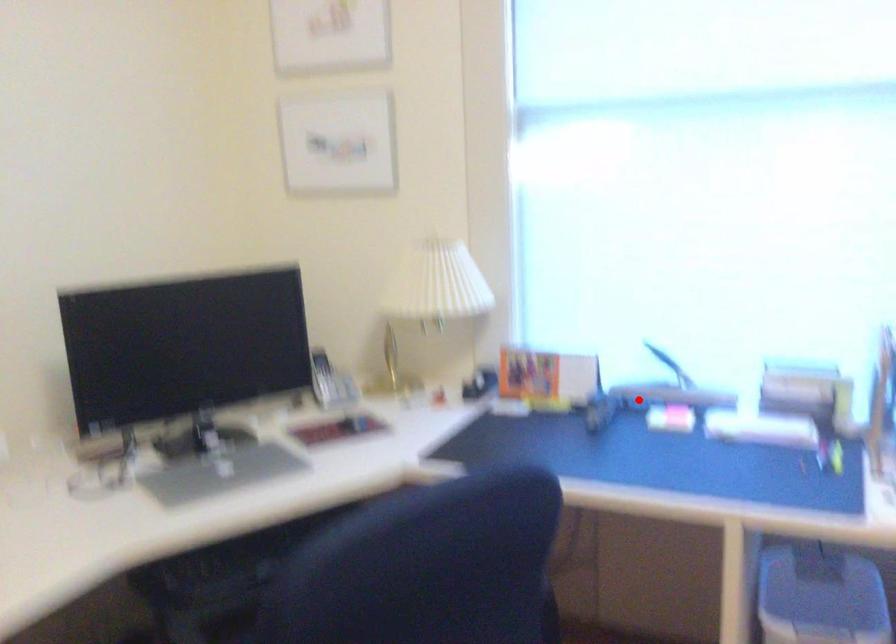
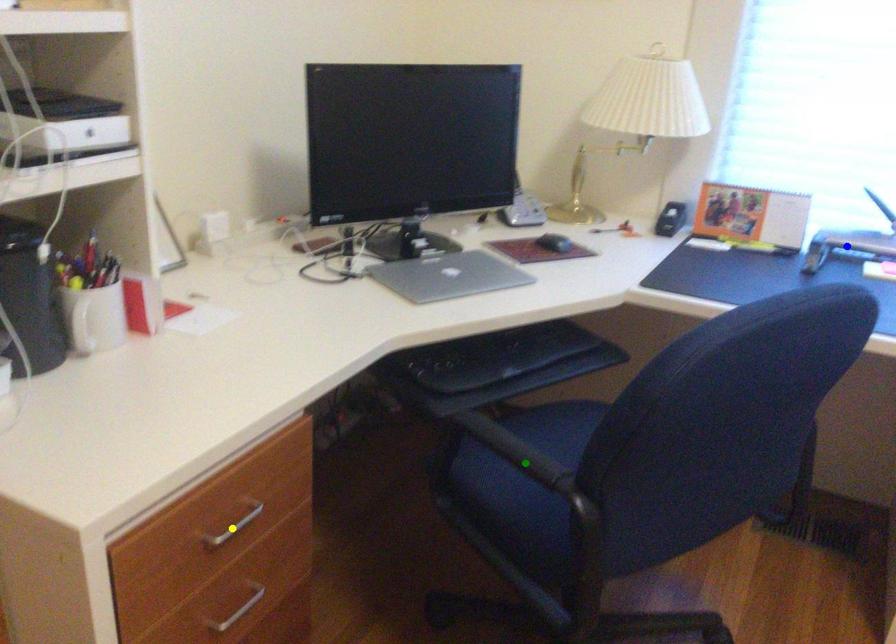
Question: I am providing you with two images of the same scene from different viewpoints. A red point is marked on the first image. You are given multiple points on the second image. Can you choose the point in image 2 that corresponds to the point in image 1?

Choices:
 (A) blue point
 (B) green point
 (C) yellow point

Answer: (A)